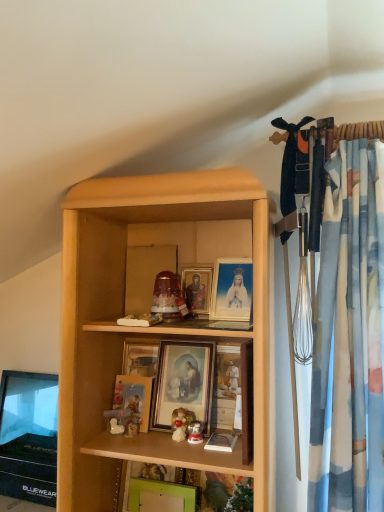
Question: Which direction should I rotate to look at matte gold picture frame at center, the 3th picture frame when ordered from bottom to top?

Choices:
 (A) right
 (B) left

Answer: (B)

Question: Does wooden picture frame at center, placed as the first picture frame when sorted from top to bottom, have a smaller size compared to matte gold picture frame at center, marked as the 2th picture frame in a top-to-bottom arrangement?

Choices:
 (A) no
 (B) yes

Answer: (B)

Question: Is wooden picture frame at center, acting as the 4th picture frame starting from the bottom, at the left side of matte gold picture frame at center, marked as the 2th picture frame in a top-to-bottom arrangement?

Choices:
 (A) yes
 (B) no

Answer: (B)

Question: Considering the relative sizes of wooden picture frame at center, acting as the 4th picture frame starting from the bottom, and matte gold picture frame at center, the 3th picture frame when ordered from bottom to top, in the image provided, is wooden picture frame at center, acting as the 4th picture frame starting from the bottom, wider than matte gold picture frame at center, the 3th picture frame when ordered from bottom to top,?

Choices:
 (A) yes
 (B) no

Answer: (A)

Question: Is wooden picture frame at center, acting as the 4th picture frame starting from the bottom, to the right of matte gold picture frame at center, marked as the 2th picture frame in a top-to-bottom arrangement, from the viewer's perspective?

Choices:
 (A) no
 (B) yes

Answer: (B)

Question: Could you tell me if wooden picture frame at center, placed as the first picture frame when sorted from top to bottom, is turned towards matte gold picture frame at center, the 3th picture frame when ordered from bottom to top?

Choices:
 (A) yes
 (B) no

Answer: (B)

Question: Is wooden picture frame at center, placed as the first picture frame when sorted from top to bottom, in front of matte gold picture frame at center, the 3th picture frame when ordered from bottom to top?

Choices:
 (A) yes
 (B) no

Answer: (B)

Question: Does wooden picture frame at center, acting as the 4th picture frame starting from the bottom, have a greater height compared to matte gold picture frame at center, acting as the third picture frame starting from the top?

Choices:
 (A) yes
 (B) no

Answer: (B)

Question: Does wooden picture frame at center, acting as the 4th picture frame starting from the bottom, have a lesser height compared to matte gold picture frame at center, positioned as the second picture frame in bottom-to-top order?

Choices:
 (A) yes
 (B) no

Answer: (A)

Question: Does wooden picture frame at center, acting as the 4th picture frame starting from the bottom, appear on the left side of matte gold picture frame at center, acting as the third picture frame starting from the top?

Choices:
 (A) no
 (B) yes

Answer: (A)

Question: Is wooden picture frame at center, acting as the 4th picture frame starting from the bottom, not close to matte gold picture frame at center, positioned as the second picture frame in bottom-to-top order?

Choices:
 (A) yes
 (B) no

Answer: (B)

Question: Does wooden picture frame at center, placed as the first picture frame when sorted from top to bottom, have a smaller size compared to matte gold picture frame at center, acting as the third picture frame starting from the top?

Choices:
 (A) yes
 (B) no

Answer: (A)

Question: Can you confirm if wooden picture frame at center, placed as the first picture frame when sorted from top to bottom, is positioned to the right of matte gold picture frame at center, acting as the third picture frame starting from the top?

Choices:
 (A) no
 (B) yes

Answer: (B)

Question: Considering the relative positions of matte gold picture frame at center, positioned as the second picture frame in bottom-to-top order, and green matte picture frame at lower center, which appears as the first picture frame when ordered from the bottom, in the image provided, is matte gold picture frame at center, positioned as the second picture frame in bottom-to-top order, in front of green matte picture frame at lower center, which appears as the first picture frame when ordered from the bottom,?

Choices:
 (A) yes
 (B) no

Answer: (B)